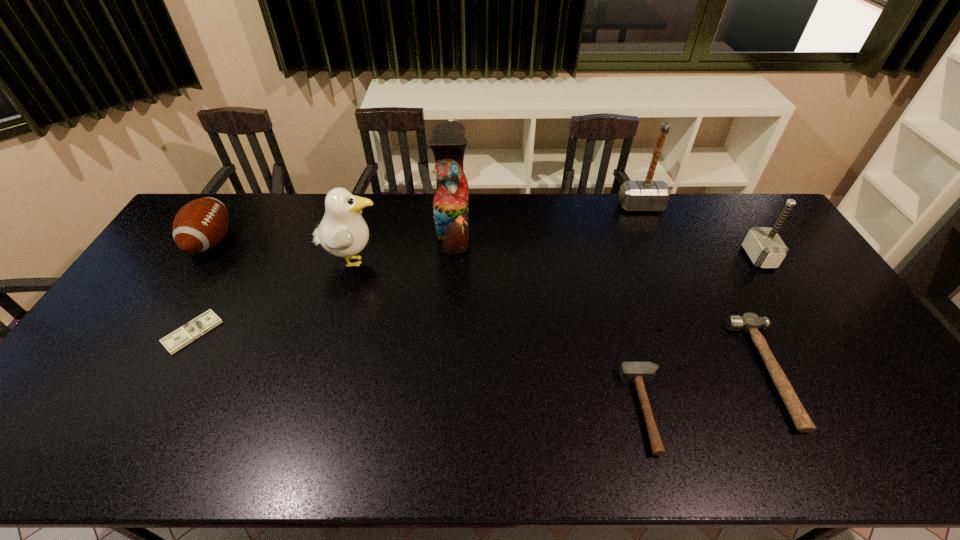
Find the location of a particular element. free spot between the leftmost hammer and the second hammer from right to left is located at coordinates (708, 391).

This screenshot has height=540, width=960. What are the coordinates of `vacant space that's between the dollar and the fourth shortest object` in the screenshot? It's located at (202, 287).

The width and height of the screenshot is (960, 540). I want to click on free space between the sixth object from left to right and the second hammer from right to left, so click(x=705, y=289).

I want to click on unoccupied position between the second object from right to left and the leftmost hammer, so click(708, 391).

I want to click on free space between the sixth object from right to left and the fifth shortest object, so click(555, 259).

Image resolution: width=960 pixels, height=540 pixels. What are the coordinates of `free space between the seventh object from left to right and the fourth object from right to left` in the screenshot? It's located at (708, 391).

At what (x,y) coordinates should I click in order to perform the action: click on object that stands as the seventh closest to the second object from right to left. Please return your answer as a coordinate pair (x, y). The width and height of the screenshot is (960, 540). Looking at the image, I should click on (199, 225).

Identify the location of object that is the second closest one to the second hammer from left to right. (750, 323).

Point out which hammer is positioned as the second nearest to the leftmost hammer. Please provide its 2D coordinates. Your answer should be formatted as a tuple, i.e. [(x, y)], where the tuple contains the x and y coordinates of a point satisfying the conditions above.

[(763, 245)]

The height and width of the screenshot is (540, 960). I want to click on hammer that stands as the second closest to the football, so click(648, 195).